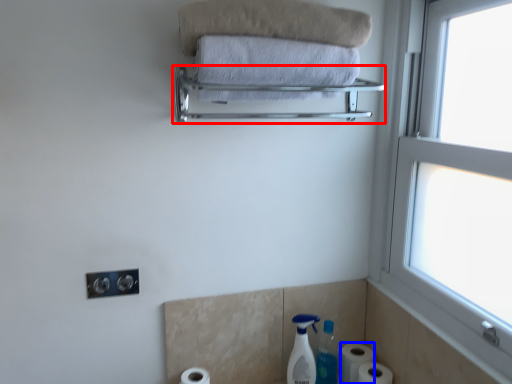
Question: Which object is further to the camera taking this photo, balustrade (highlighted by a red box) or toilet paper (highlighted by a blue box)?

Choices:
 (A) balustrade
 (B) toilet paper

Answer: (B)